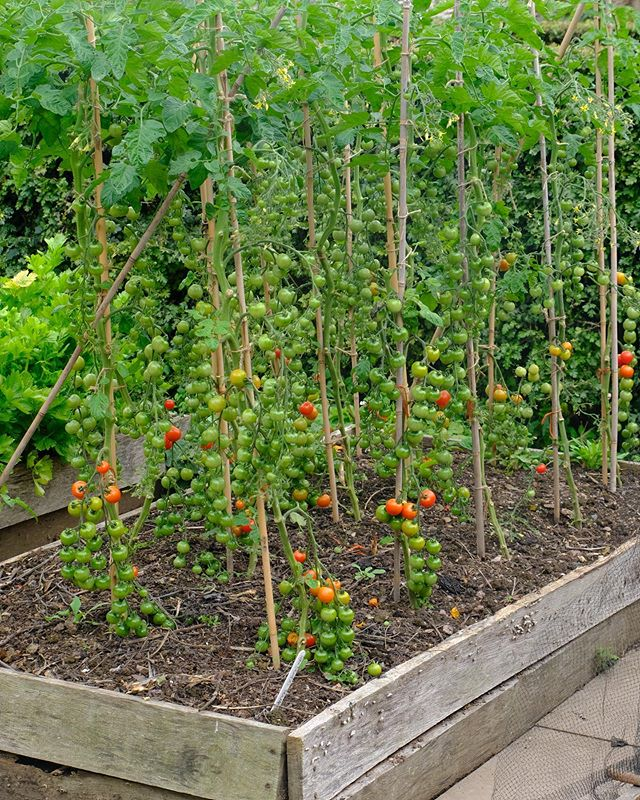
Find the location of a particular element. Image resolution: width=640 pixels, height=800 pixels. support poles is located at coordinates (95, 157), (221, 366), (242, 330), (316, 317), (351, 357), (395, 266), (473, 374), (490, 345), (610, 337), (19, 438).